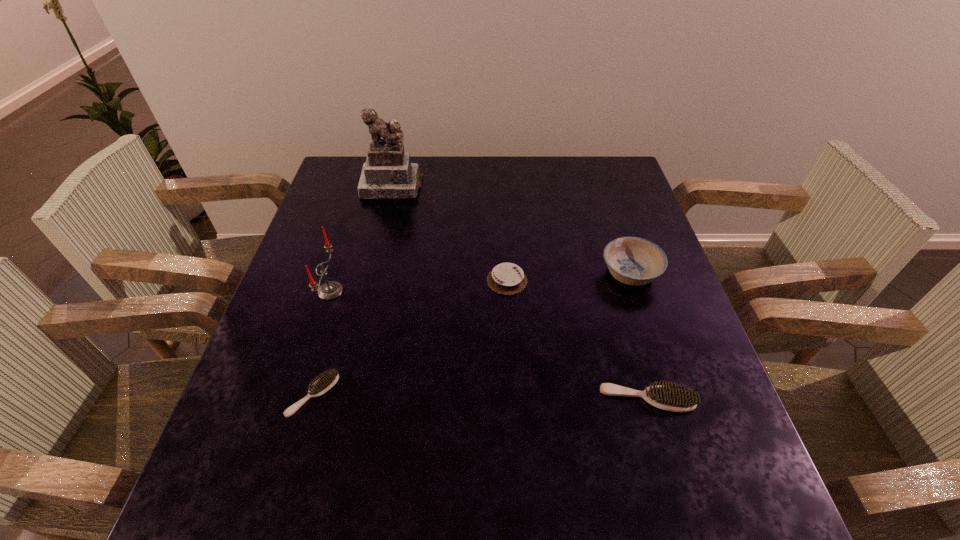
Find the location of a particular element. object present at the far left corner is located at coordinates (388, 172).

The width and height of the screenshot is (960, 540). Find the location of `object present at the near left corner`. object present at the near left corner is located at coordinates (327, 380).

You are a GUI agent. You are given a task and a screenshot of the screen. Output one action in this format:
    pyautogui.click(x=<x>, y=<y>)
    Task: Click on the object positioned at the near right corner
    This screenshot has height=540, width=960.
    Given the screenshot: What is the action you would take?
    pyautogui.click(x=675, y=398)

In the image, there is a desktop. Where is `vacant space at the near edge`? The height and width of the screenshot is (540, 960). vacant space at the near edge is located at coordinates (488, 434).

In the image, there is a desktop. Identify the location of vacant space at the left edge. The height and width of the screenshot is (540, 960). (304, 340).

The image size is (960, 540). In the image, there is a desktop. In order to click on vacant space at the right edge in this screenshot , I will do coord(692,352).

Image resolution: width=960 pixels, height=540 pixels. Identify the location of vacant area at the far left corner. (366, 200).

The width and height of the screenshot is (960, 540). What are the coordinates of `blank space at the far right corner` in the screenshot? It's located at (616, 174).

The width and height of the screenshot is (960, 540). I want to click on empty space between the shorter scrubbing brush and the bowl, so click(x=471, y=334).

I want to click on empty location between the second tallest object and the left scrubbing brush, so 322,343.